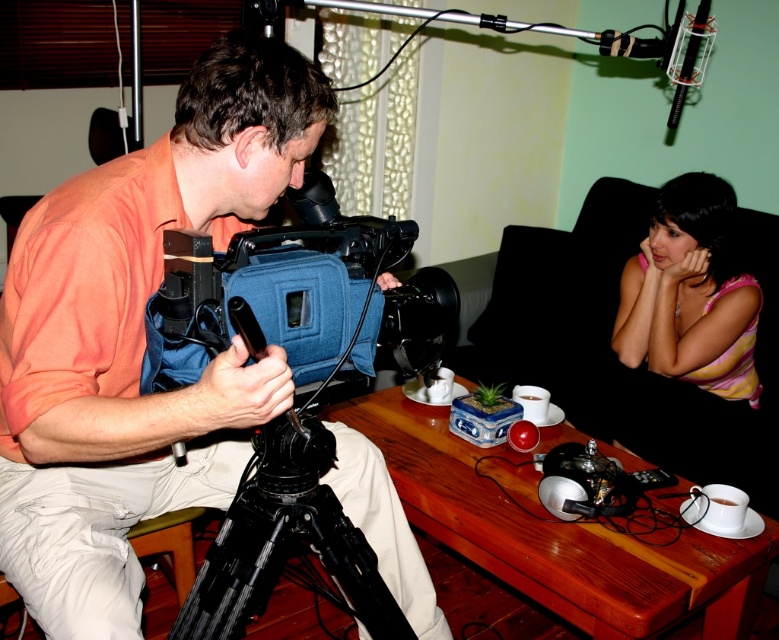
You are a photographer trying to position a new light stand between the black metal tripod at lower center and the pink striped shirt at upper right. Which object should you place the light stand closer to if you want it to be near the narrower object?

The black metal tripod at lower center has a lesser width compared to the pink striped shirt at upper right, so you should place the light stand closer to the black metal tripod at lower center.

You are a photographer trying to set up a shot in the studio. You have a black metal tripod at lower center and a pink striped shirt at upper right in your frame. Which object takes up more space in the image?

The pink striped shirt at upper right takes up more space in the image than the black metal tripod at lower center because the pink striped shirt at upper right is larger according to the description.